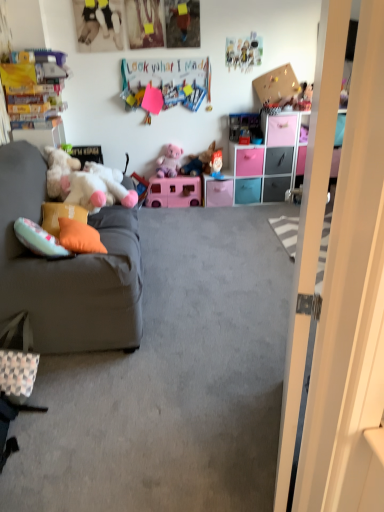
Find the location of a particular element. free space between checkered fabric bag at lower left and matte black drawer at center, which is counted as the 1th drawer, starting from the right is located at coordinates (193, 258).